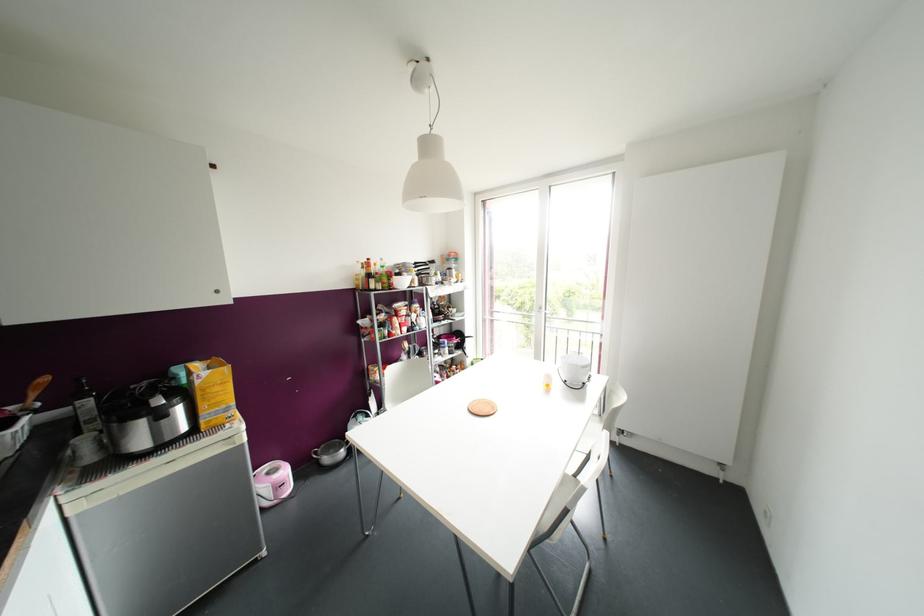
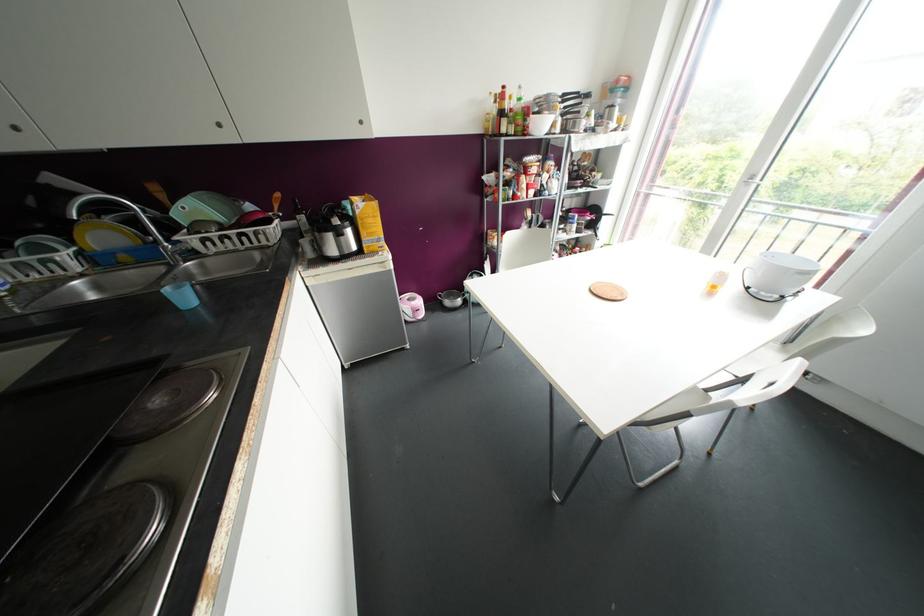
Where in the second image is the point corresponding to (x=582, y=383) from the first image?

(782, 297)